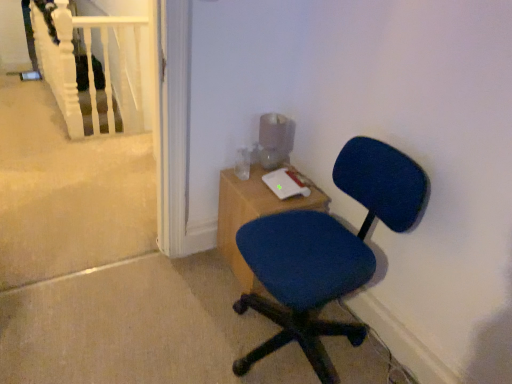
Where is `vacant space positioned to the left of blue fabric chair at center`? The width and height of the screenshot is (512, 384). vacant space positioned to the left of blue fabric chair at center is located at coordinates (166, 319).